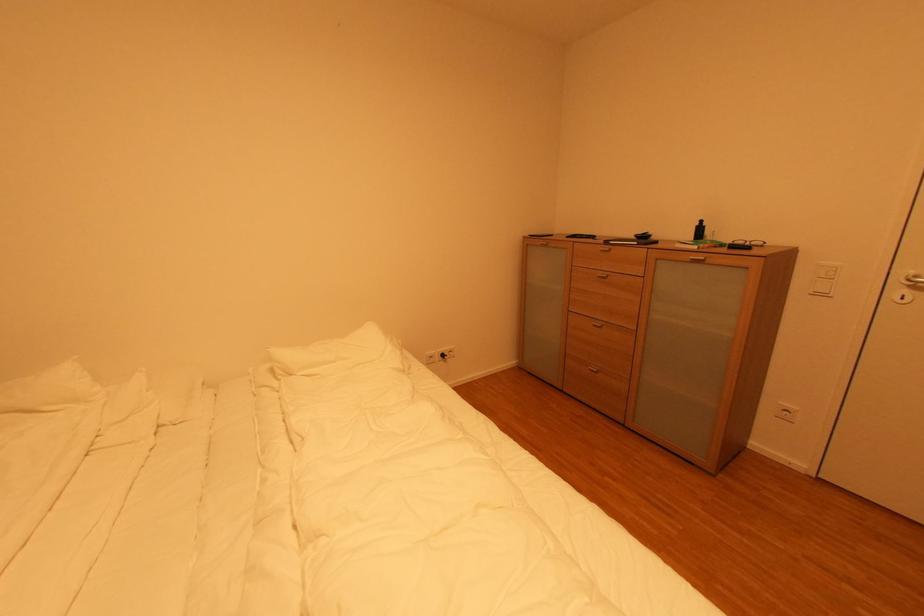
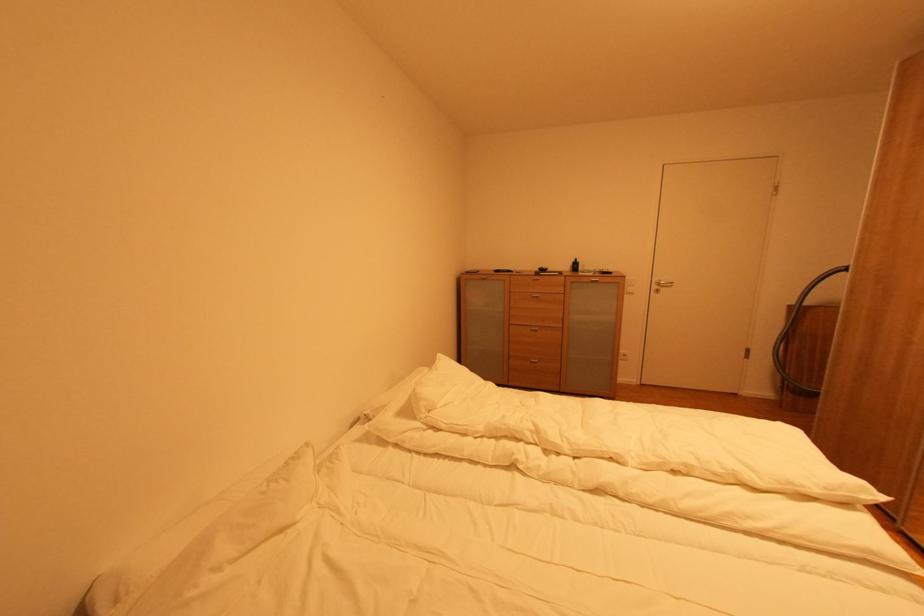
Locate, in the second image, the point that corresponds to (611,278) in the first image.

(542, 298)